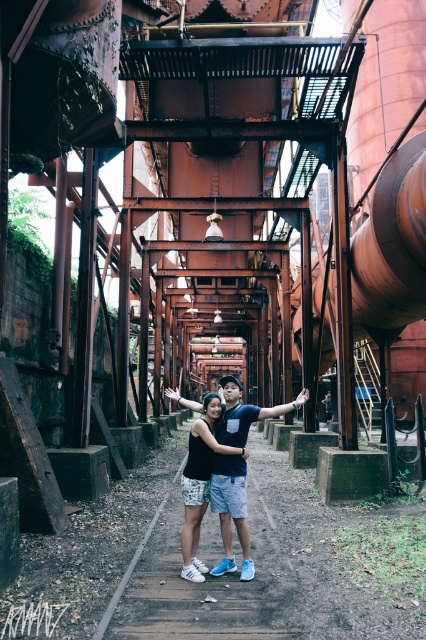
You are a photographer trying to capture the black matte shirt at center and the matte black arm at center in a new shot. Which object should you focus on first if you want to ensure both are in sharp focus?

The black matte shirt at center is located above the matte black arm at center, so focusing on the black matte shirt at center first will help ensure both are in sharp focus.

You are a photographer trying to capture the two people on the wooden walkway. You want to ensure the matte black tank top at center and the matte black arm at center are both visible in the frame. Which object should you position closer to the left side of your camera viewfinder to achieve this?

To ensure both the matte black tank top at center and the matte black arm at center are visible, position the matte black tank top at center closer to the left side of the camera viewfinder since it is already to the left of the matte black arm at center.

You are standing at the point with coordinates point (x=275, y=413) and want to move to the point with coordinates point (x=215, y=445). In which direction should you move to reach your destination?

You should move forward because point (x=215, y=445) is in front of point (x=275, y=413).